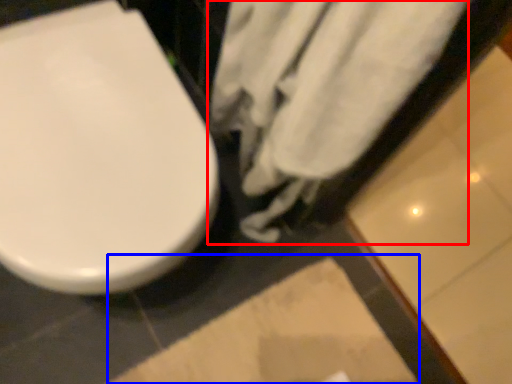
Question: Which of the following is the farthest to the observer, bath towel (highlighted by a red box) or square (highlighted by a blue box)?

Choices:
 (A) bath towel
 (B) square

Answer: (B)